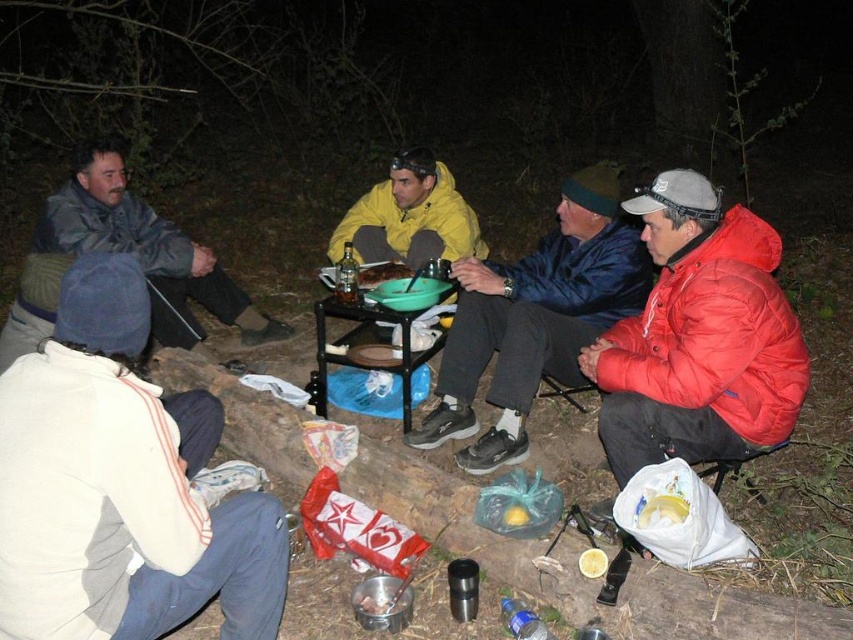
You are planning to place a decorative centerpiece on the smooth plastic plate at center. Considering the black metal picnic table at center, is there enough space to place the plate without it hanging over the edge?

The black metal picnic table at center is positioned under smooth plastic plate at center, so there is enough space to place the plate without it hanging over the edge.

You are standing at the point labeled point (x=262, y=528) and want to move towards the point labeled point (x=141, y=262). Given the uneven terrain and scattered debris on the ground, which direction should you move to reach your destination safely?

Since point (x=262, y=528) is closer to the viewer than point (x=141, y=262), you should move forward towards the destination while being cautious of the uneven ground and debris in your path.